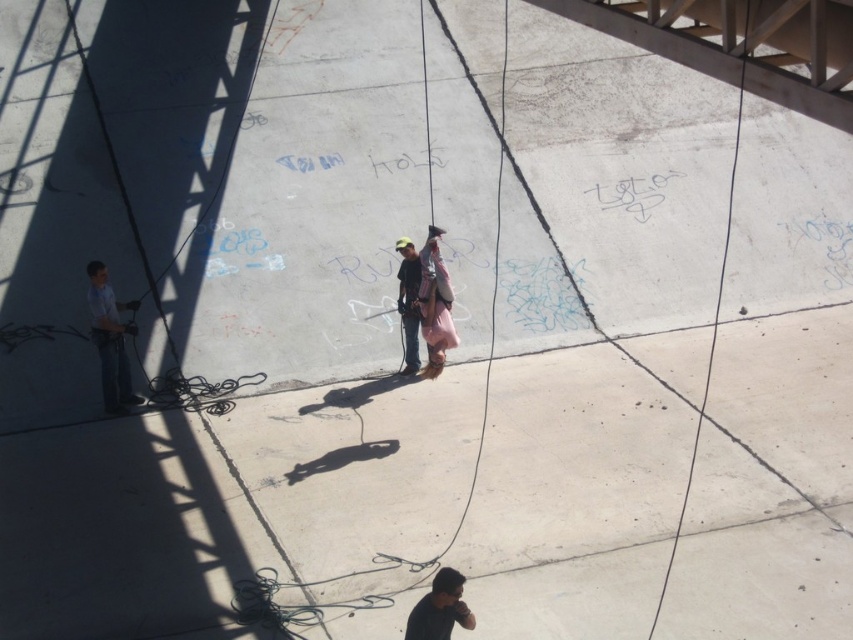
Question: Which object appears farthest from the camera in this image?

Choices:
 (A) light blue shirt at left
 (B) pink fabric at center
 (C) matte black shirt at center

Answer: (C)

Question: Which object is closer to the camera taking this photo?

Choices:
 (A) matte black shirt at center
 (B) dark gray fabric shirt at lower center
 (C) pink fabric at center
 (D) light blue shirt at left

Answer: (B)

Question: Considering the real-world distances, which object is farthest from the pink fabric at center?

Choices:
 (A) light blue shirt at left
 (B) dark gray fabric shirt at lower center
 (C) matte black shirt at center

Answer: (B)

Question: Does dark gray fabric shirt at lower center have a smaller size compared to matte black shirt at center?

Choices:
 (A) no
 (B) yes

Answer: (B)

Question: Is light blue shirt at left above dark gray fabric shirt at lower center?

Choices:
 (A) no
 (B) yes

Answer: (B)

Question: Does pink fabric at center appear on the right side of matte black shirt at center?

Choices:
 (A) yes
 (B) no

Answer: (A)